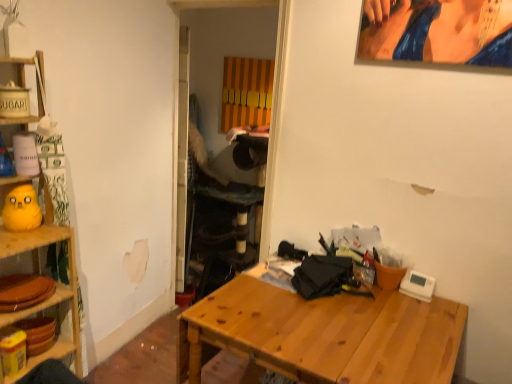
Question: Can you confirm if wooden shelf at left is thinner than wooden table at center?

Choices:
 (A) no
 (B) yes

Answer: (B)

Question: From a real-world perspective, is wooden shelf at left located beneath wooden table at center?

Choices:
 (A) no
 (B) yes

Answer: (A)

Question: Can you confirm if wooden shelf at left is shorter than wooden table at center?

Choices:
 (A) no
 (B) yes

Answer: (A)

Question: Is wooden shelf at left taller than wooden table at center?

Choices:
 (A) yes
 (B) no

Answer: (A)

Question: Is wooden shelf at left next to wooden table at center and touching it?

Choices:
 (A) no
 (B) yes

Answer: (A)

Question: From a real-world perspective, is wooden shelf at left above or below yellow rubber duck at left?

Choices:
 (A) above
 (B) below

Answer: (B)

Question: Considering the positions of wooden shelf at left and yellow rubber duck at left in the image, is wooden shelf at left taller or shorter than yellow rubber duck at left?

Choices:
 (A) short
 (B) tall

Answer: (B)

Question: Is wooden shelf at left inside or outside of yellow rubber duck at left?

Choices:
 (A) outside
 (B) inside

Answer: (A)

Question: Considering the positions of wooden shelf at left and yellow rubber duck at left in the image, is wooden shelf at left wider or thinner than yellow rubber duck at left?

Choices:
 (A) wide
 (B) thin

Answer: (A)

Question: From the image's perspective, is wooden table at center above or below yellow rubber duck at left?

Choices:
 (A) above
 (B) below

Answer: (B)

Question: In terms of height, does wooden table at center look taller or shorter compared to yellow rubber duck at left?

Choices:
 (A) tall
 (B) short

Answer: (A)

Question: Is wooden table at center in front of or behind yellow rubber duck at left in the image?

Choices:
 (A) front
 (B) behind

Answer: (A)

Question: From a real-world perspective, is wooden table at center above or below yellow rubber duck at left?

Choices:
 (A) below
 (B) above

Answer: (A)

Question: Considering the positions of yellow rubber duck at left and wooden shelf at left in the image, is yellow rubber duck at left bigger or smaller than wooden shelf at left?

Choices:
 (A) small
 (B) big

Answer: (A)

Question: From the image's perspective, is yellow rubber duck at left located above or below wooden shelf at left?

Choices:
 (A) below
 (B) above

Answer: (B)